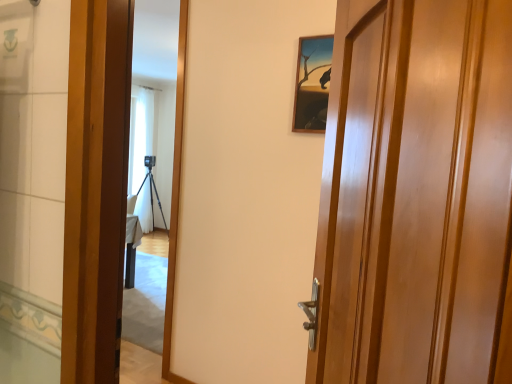
Locate an element on the screen. This screenshot has width=512, height=384. glossy wood door at center right is located at coordinates (416, 196).

The image size is (512, 384). What do you see at coordinates (416, 196) in the screenshot?
I see `glossy wood door at center right` at bounding box center [416, 196].

Identify the location of glossy wood door at center right. click(416, 196).